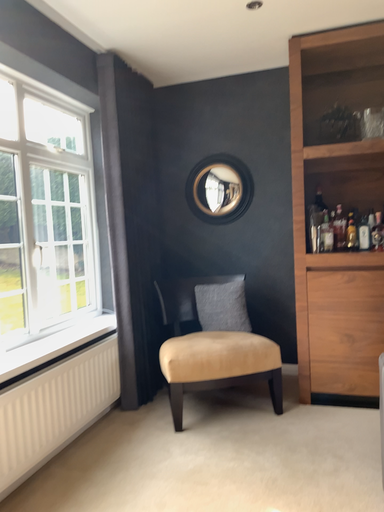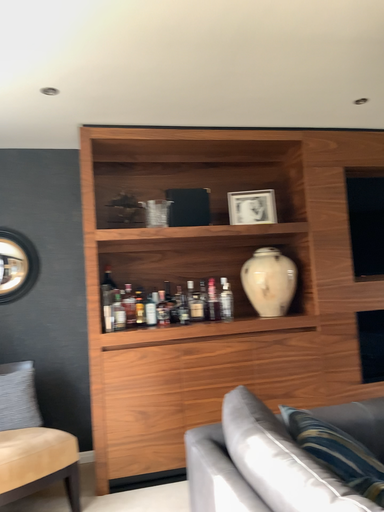
Question: How did the camera likely rotate when shooting the video?

Choices:
 (A) rotated left
 (B) rotated right

Answer: (B)